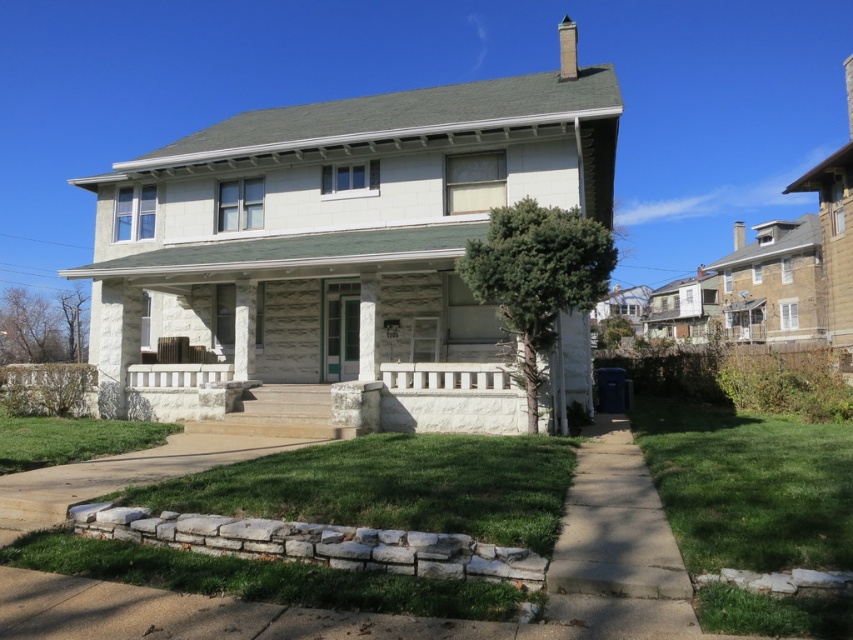
Question: Can you confirm if white stone porch at center is positioned below white stone column at center?

Choices:
 (A) no
 (B) yes

Answer: (B)

Question: From the image, what is the correct spatial relationship of white stone porch at center in relation to white stone column at center?

Choices:
 (A) right
 (B) left

Answer: (A)

Question: Among these points, which one is nearest to the camera?

Choices:
 (A) [x=448, y=390]
 (B) [x=364, y=292]

Answer: (A)

Question: Which point is closer to the camera?

Choices:
 (A) (374, 310)
 (B) (512, 403)

Answer: (B)

Question: Observing the image, what is the correct spatial positioning of white stone porch at center in reference to white stone column at center?

Choices:
 (A) left
 (B) right

Answer: (B)